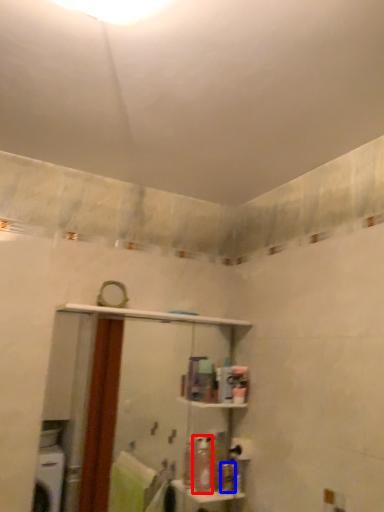
Question: Which object is further to the camera taking this photo, toiletry (highlighted by a red box) or toiletry (highlighted by a blue box)?

Choices:
 (A) toiletry
 (B) toiletry

Answer: (B)